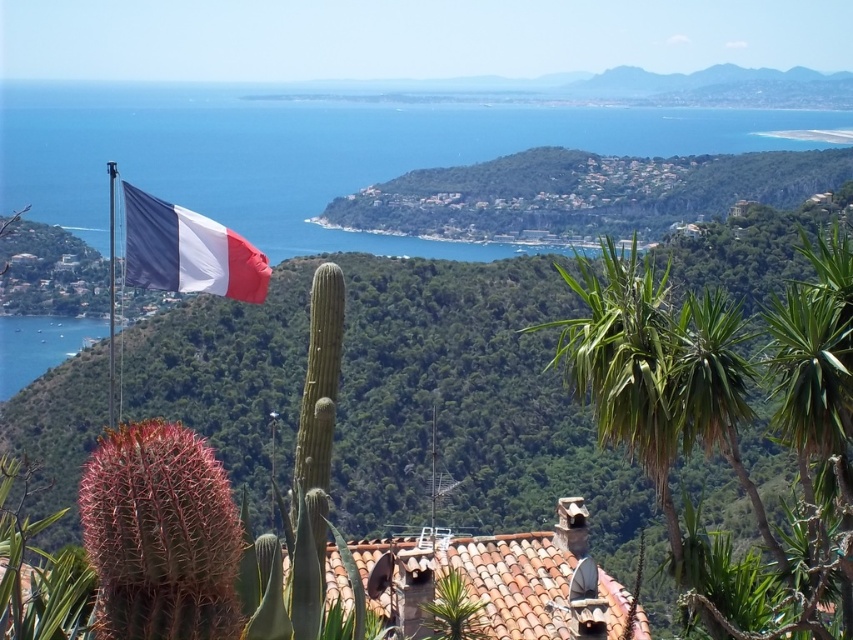
Question: Which object is farther from the camera taking this photo?

Choices:
 (A) matte fabric flag at upper left
 (B) green leafy cactus at upper left

Answer: (A)

Question: Does blue water at upper center lie in front of green leafy palm tree at center?

Choices:
 (A) yes
 (B) no

Answer: (B)

Question: Can you confirm if blue water at upper center is bigger than matte fabric flag at upper left?

Choices:
 (A) yes
 (B) no

Answer: (A)

Question: In this image, where is blue water at upper center located relative to matte fabric flag at upper left?

Choices:
 (A) above
 (B) below

Answer: (A)

Question: Considering the real-world distances, which object is farthest from the green leafy palm tree at center?

Choices:
 (A) matte fabric flag at upper left
 (B) green leafy cactus at upper left
 (C) blue water at upper center

Answer: (C)

Question: Which of these objects is positioned farthest from the blue water at upper center?

Choices:
 (A) matte fabric flag at upper left
 (B) green leafy cactus at upper left
 (C) green leafy palm tree at center

Answer: (A)